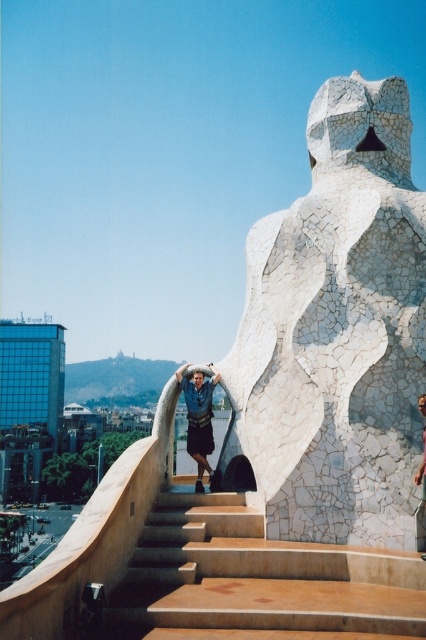
Which is in front, point (403, 243) or point (419, 483)?

Positioned in front is point (419, 483).

Is white mosaic statue at center further to camera compared to blue denim shorts at upper center?

Yes, it is behind blue denim shorts at upper center.

Between point (282, 324) and point (423, 461), which one is positioned behind?

The point (282, 324) is more distant.

You are a GUI agent. You are given a task and a screenshot of the screen. Output one action in this format:
    pyautogui.click(x=<x>, y=<y>)
    Task: Click on the white mosaic statue at center
    The width and height of the screenshot is (426, 640).
    Given the screenshot: What is the action you would take?
    pyautogui.click(x=336, y=330)

Between point (163, 499) and point (425, 557), which one is positioned in front?

Point (425, 557) is in front.

This screenshot has width=426, height=640. I want to click on brown stone stairs at center, so [x=256, y=580].

Is dark blue fabric at center taller than blue denim shorts at upper center?

Indeed, dark blue fabric at center has a greater height compared to blue denim shorts at upper center.

From the picture: Does dark blue fabric at center appear on the right side of blue denim shorts at upper center?

No, dark blue fabric at center is not to the right of blue denim shorts at upper center.

Is point (215, 481) behind point (423, 490)?

That is True.

You are a GUI agent. You are given a task and a screenshot of the screen. Output one action in this format:
    pyautogui.click(x=<x>, y=<y>)
    Task: Click on the dark blue fabric at center
    This screenshot has width=426, height=640.
    Given the screenshot: What is the action you would take?
    pyautogui.click(x=199, y=420)